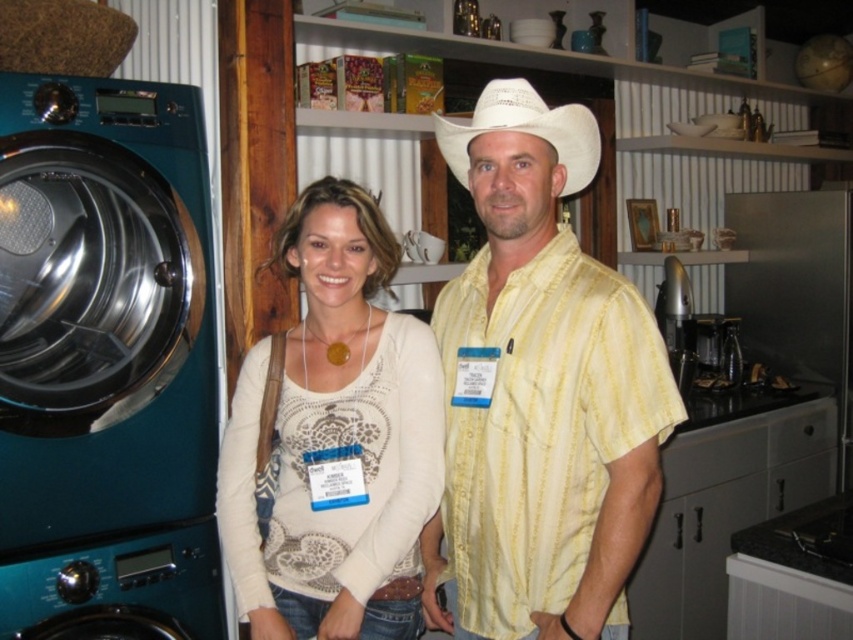
You are standing in a kitchen and need to reach the yellow striped shirt at center to retrieve a key from its pocket. The key is located at coordinates point 0.614, 0.634. Can you reach it without moving the shirt?

The yellow striped shirt at center is positioned at point (540, 392), so yes, you can reach the key at those coordinates without needing to move the shirt.

You are standing in a kitchen and see two points marked on the wall. The first point is at position point (x=3, y=205) and the second point is at position point (x=386, y=312). Which point is closer to you?

Point (x=3, y=205) is closer to you because it is further to the camera than point (x=386, y=312).